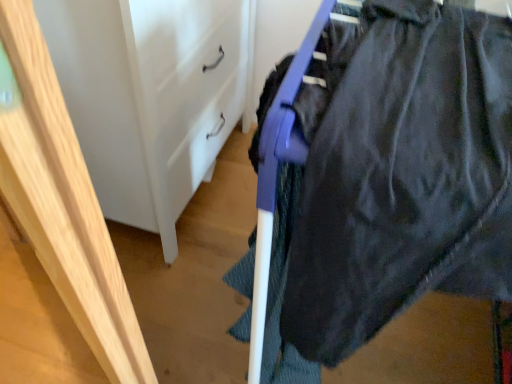
Question: From the image's perspective, would you say white matte/file cabinet at center is shown under light wood frame at left?

Choices:
 (A) yes
 (B) no

Answer: (B)

Question: Does white matte/file cabinet at center appear on the left side of light wood frame at left?

Choices:
 (A) no
 (B) yes

Answer: (A)

Question: Is white matte/file cabinet at center bigger than light wood frame at left?

Choices:
 (A) no
 (B) yes

Answer: (B)

Question: Is white matte/file cabinet at center directly adjacent to light wood frame at left?

Choices:
 (A) yes
 (B) no

Answer: (B)

Question: Does white matte/file cabinet at center have a smaller size compared to light wood frame at left?

Choices:
 (A) yes
 (B) no

Answer: (B)

Question: Does white matte/file cabinet at center have a greater height compared to light wood frame at left?

Choices:
 (A) yes
 (B) no

Answer: (B)

Question: Is light wood frame at left positioned far away from dark matte fabric at upper right?

Choices:
 (A) yes
 (B) no

Answer: (B)

Question: Can you confirm if light wood frame at left is taller than dark matte fabric at upper right?

Choices:
 (A) yes
 (B) no

Answer: (A)

Question: Is light wood frame at left at the right side of dark matte fabric at upper right?

Choices:
 (A) no
 (B) yes

Answer: (A)

Question: Does light wood frame at left come in front of dark matte fabric at upper right?

Choices:
 (A) yes
 (B) no

Answer: (A)

Question: Is light wood frame at left wider than dark matte fabric at upper right?

Choices:
 (A) no
 (B) yes

Answer: (A)

Question: Is light wood frame at left surrounding dark matte fabric at upper right?

Choices:
 (A) no
 (B) yes

Answer: (A)

Question: Can you confirm if white matte/file cabinet at center is wider than dark matte fabric at upper right?

Choices:
 (A) yes
 (B) no

Answer: (B)